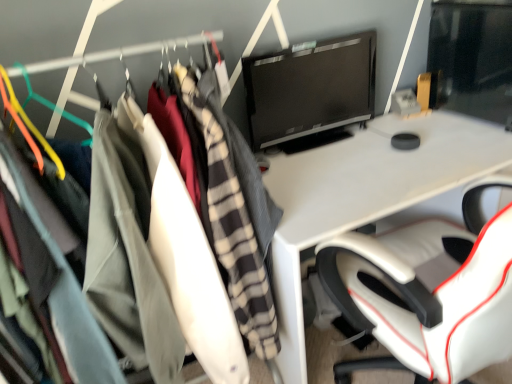
This screenshot has width=512, height=384. What do you see at coordinates (310, 88) in the screenshot? I see `black glossy monitor at upper right` at bounding box center [310, 88].

Consider the image. Measure the distance between black glossy monitor at upper right and camera.

They are 1.45 meters apart.

Identify the location of black glossy monitor at upper right. This screenshot has height=384, width=512. (310, 88).

What is the approximate height of black glossy monitor at upper right?

14.37 inches.

The height and width of the screenshot is (384, 512). I want to click on light gray fabric coat at left, so click(200, 257).

Describe the element at coordinates (200, 257) in the screenshot. I see `light gray fabric coat at left` at that location.

Locate an element on the screen. black glossy monitor at upper right is located at coordinates (310, 88).

Between light gray fabric coat at left and black glossy monitor at upper right, which one appears on the left side from the viewer's perspective?

Positioned to the left is light gray fabric coat at left.

Which object is further away from the camera, light gray fabric coat at left or black glossy monitor at upper right?

Positioned behind is black glossy monitor at upper right.

Which is less distant, (258, 269) or (265, 92)?

The point (258, 269) is in front.

From the image's perspective, which one is positioned lower, light gray fabric coat at left or black glossy monitor at upper right?

light gray fabric coat at left is shown below in the image.

From a real-world perspective, between light gray fabric coat at left and black glossy monitor at upper right, who is vertically lower?

light gray fabric coat at left, from a real-world perspective.

Considering the sizes of objects light gray fabric coat at left and black glossy monitor at upper right in the image provided, who is wider, light gray fabric coat at left or black glossy monitor at upper right?

Wider between the two is light gray fabric coat at left.

Who is taller, light gray fabric coat at left or black glossy monitor at upper right?

With more height is light gray fabric coat at left.

Who is smaller, light gray fabric coat at left or black glossy monitor at upper right?

Smaller between the two is black glossy monitor at upper right.

Is black glossy monitor at upper right a part of light gray fabric coat at left?

That's incorrect, black glossy monitor at upper right is not inside light gray fabric coat at left.

Would you say light gray fabric coat at left is a long distance from black glossy monitor at upper right?

light gray fabric coat at left is near black glossy monitor at upper right, not far away.

Is light gray fabric coat at left looking in the opposite direction of black glossy monitor at upper right?

No, light gray fabric coat at left is not facing the opposite direction of black glossy monitor at upper right.

This screenshot has width=512, height=384. I want to click on clothing that appears below the black glossy monitor at upper right (from the image's perspective), so click(x=200, y=257).

Can you confirm if black glossy monitor at upper right is positioned to the left of light gray fabric coat at left?

No.

In the scene shown: Is black glossy monitor at upper right positioned in front of light gray fabric coat at left?

No, black glossy monitor at upper right is behind light gray fabric coat at left.

Is point (345, 93) farther from camera compared to point (158, 259)?

Yes.

From the image's perspective, is black glossy monitor at upper right on top of light gray fabric coat at left?

Yes, from the image's perspective, black glossy monitor at upper right is on top of light gray fabric coat at left.

From a real-world perspective, which object rests below the other?

light gray fabric coat at left, from a real-world perspective.

Considering the relative sizes of black glossy monitor at upper right and light gray fabric coat at left in the image provided, is black glossy monitor at upper right thinner than light gray fabric coat at left?

Correct, the width of black glossy monitor at upper right is less than that of light gray fabric coat at left.

Considering the sizes of objects black glossy monitor at upper right and light gray fabric coat at left in the image provided, who is taller, black glossy monitor at upper right or light gray fabric coat at left?

light gray fabric coat at left is taller.

Which of these two, black glossy monitor at upper right or light gray fabric coat at left, is smaller?

With smaller size is black glossy monitor at upper right.

Choose the correct answer: Is black glossy monitor at upper right inside light gray fabric coat at left or outside it?

black glossy monitor at upper right is located beyond the bounds of light gray fabric coat at left.

Are black glossy monitor at upper right and light gray fabric coat at left located far from each other?

They are positioned close to each other.

Could you tell me if black glossy monitor at upper right is turned towards light gray fabric coat at left?

No, black glossy monitor at upper right does not turn towards light gray fabric coat at left.

Locate an element on the screen. computer monitor lying above the light gray fabric coat at left (from the image's perspective) is located at coordinates (310, 88).

The image size is (512, 384). I want to click on computer monitor lying above the light gray fabric coat at left (from the image's perspective), so click(x=310, y=88).

Where is `clothing below the black glossy monitor at upper right (from a real-world perspective)`? clothing below the black glossy monitor at upper right (from a real-world perspective) is located at coordinates (200, 257).